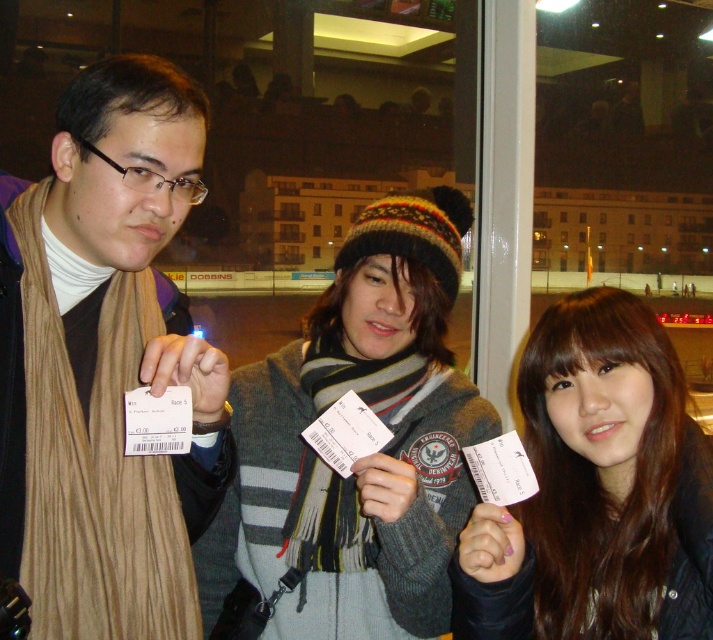
Consider the image. Can you confirm if gray knit sweater at center is shorter than brown matte hair at center?

No, gray knit sweater at center is not shorter than brown matte hair at center.

Is gray knit sweater at center wider than brown matte hair at center?

Yes.

At what (x,y) coordinates should I click in order to perform the action: click on gray knit sweater at center. Please return your answer as a coordinate pair (x, y). The height and width of the screenshot is (640, 713). Looking at the image, I should click on (364, 458).

Between brown wool scarf at left and brown matte hair at center, which one appears on the left side from the viewer's perspective?

From the viewer's perspective, brown wool scarf at left appears more on the left side.

Is brown wool scarf at left shorter than brown matte hair at center?

No.

Is point (16, 232) in front of point (573, 467)?

Yes, it is in front of point (573, 467).

The height and width of the screenshot is (640, 713). Identify the location of brown wool scarf at left. (106, 362).

Which is behind, point (194, 344) or point (302, 403)?

The point (302, 403) is behind.

Does point (173, 336) lie in front of point (332, 540)?

Yes, point (173, 336) is in front of point (332, 540).

Where is `brown wool scarf at left`? Image resolution: width=713 pixels, height=640 pixels. brown wool scarf at left is located at coordinates (106, 362).